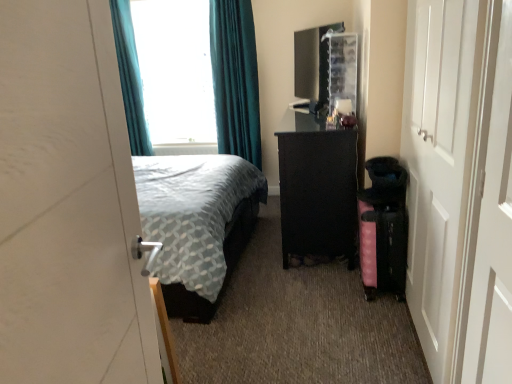
Locate an element on the screen. Image resolution: width=512 pixels, height=384 pixels. teal fabric curtain at upper center, the 2th curtain in the left-to-right sequence is located at coordinates (234, 79).

What do you see at coordinates (325, 67) in the screenshot?
I see `black glossy file cabinet at upper center` at bounding box center [325, 67].

In order to face black glossy file cabinet at upper center, should I rotate leftwards or rightwards?

Rotate your view right by about 7.676°.

Measure the distance between teal fabric curtain at upper left, the 2th curtain from the right, and camera.

teal fabric curtain at upper left, the 2th curtain from the right, and camera are 3.67 meters apart.

The height and width of the screenshot is (384, 512). What do you see at coordinates (175, 71) in the screenshot?
I see `teal fabric curtain at upper left` at bounding box center [175, 71].

In order to face black textured dresser at center, should I rotate leftwards or rightwards?

Rotate your view right by about 8.618°.

Find the location of a particular element. teal fabric curtain at upper center, the 1th curtain in the right-to-left sequence is located at coordinates (234, 79).

From a real-world perspective, does teal fabric curtain at upper left, the 2th curtain from the right, stand above teal fabric curtain at upper left?

No, from a real-world perspective, teal fabric curtain at upper left, the 2th curtain from the right, is not above teal fabric curtain at upper left.

Considering the relative positions of teal fabric curtain at upper left, positioned as the 1th curtain in left-to-right order, and teal fabric curtain at upper left in the image provided, is teal fabric curtain at upper left, positioned as the 1th curtain in left-to-right order, to the left of teal fabric curtain at upper left from the viewer's perspective?

Yes, teal fabric curtain at upper left, positioned as the 1th curtain in left-to-right order, is to the left of teal fabric curtain at upper left.

In terms of width, does teal fabric curtain at upper left, the 2th curtain from the right, look wider or thinner when compared to teal fabric curtain at upper left?

teal fabric curtain at upper left, the 2th curtain from the right, is thinner than teal fabric curtain at upper left.

Is teal fabric curtain at upper left, the 2th curtain from the right, far from teal fabric curtain at upper left?

teal fabric curtain at upper left, the 2th curtain from the right, is actually quite close to teal fabric curtain at upper left.

Considering the relative positions of black textured dresser at center and teal fabric curtain at upper center, the 2th curtain in the left-to-right sequence, in the image provided, is black textured dresser at center behind teal fabric curtain at upper center, the 2th curtain in the left-to-right sequence,?

No.

From the picture: Which object is wider, black textured dresser at center or teal fabric curtain at upper center, the 2th curtain in the left-to-right sequence?

Wider between the two is black textured dresser at center.

Is black textured dresser at center facing towards teal fabric curtain at upper center, the 2th curtain in the left-to-right sequence?

No, black textured dresser at center is not aimed at teal fabric curtain at upper center, the 2th curtain in the left-to-right sequence.

Considering the relative sizes of black textured dresser at center and teal fabric curtain at upper center, the 2th curtain in the left-to-right sequence, in the image provided, is black textured dresser at center shorter than teal fabric curtain at upper center, the 2th curtain in the left-to-right sequence,?

Indeed, black textured dresser at center has a lesser height compared to teal fabric curtain at upper center, the 2th curtain in the left-to-right sequence.

Which of these two, pink fabric suitcase at lower right or white wooden door at right, acting as the 2th door starting from the left, is thinner?

With smaller width is white wooden door at right, acting as the 2th door starting from the left.

Is pink fabric suitcase at lower right positioned far away from white wooden door at right, acting as the 2th door starting from the left?

pink fabric suitcase at lower right is near white wooden door at right, acting as the 2th door starting from the left, not far away.

Based on the photo, how many degrees apart are the facing directions of pink fabric suitcase at lower right and white wooden door at right, the first door viewed from the back?

2.03 degrees separate the facing orientations of pink fabric suitcase at lower right and white wooden door at right, the first door viewed from the back.

How far apart are pink fabric suitcase at lower right and white wooden door at right, the first door viewed from the back?

The distance of pink fabric suitcase at lower right from white wooden door at right, the first door viewed from the back, is 27.84 inches.

Consider the image. Considering the relative sizes of teal fabric curtain at upper center, the 1th curtain in the right-to-left sequence, and white wooden door at right, acting as the 2th door starting from the left, in the image provided, is teal fabric curtain at upper center, the 1th curtain in the right-to-left sequence, smaller than white wooden door at right, acting as the 2th door starting from the left,?

No, teal fabric curtain at upper center, the 1th curtain in the right-to-left sequence, is not smaller than white wooden door at right, acting as the 2th door starting from the left.

Can you confirm if teal fabric curtain at upper center, the 2th curtain in the left-to-right sequence, is positioned to the left of white wooden door at right, the first door viewed from the back?

Yes.

Considering the sizes of objects teal fabric curtain at upper center, the 1th curtain in the right-to-left sequence, and white wooden door at right, the first door from the right, in the image provided, who is wider, teal fabric curtain at upper center, the 1th curtain in the right-to-left sequence, or white wooden door at right, the first door from the right,?

teal fabric curtain at upper center, the 1th curtain in the right-to-left sequence.

From the image's perspective, is teal fabric curtain at upper center, the 1th curtain in the right-to-left sequence, on top of white wooden door at right, the first door from the right?

Correct, teal fabric curtain at upper center, the 1th curtain in the right-to-left sequence, appears higher than white wooden door at right, the first door from the right, in the image.

Is teal fabric curtain at upper left in contact with black glossy file cabinet at upper center?

No, teal fabric curtain at upper left is not in contact with black glossy file cabinet at upper center.

Is teal fabric curtain at upper left inside the boundaries of black glossy file cabinet at upper center, or outside?

teal fabric curtain at upper left is not inside black glossy file cabinet at upper center, it's outside.

This screenshot has height=384, width=512. Identify the location of window that is above the black glossy file cabinet at upper center (from the image's perspective). (175, 71).

Can you confirm if teal fabric curtain at upper left is taller than black glossy file cabinet at upper center?

Yes, teal fabric curtain at upper left is taller than black glossy file cabinet at upper center.

Is teal fabric curtain at upper left closer to the viewer compared to teal fabric curtain at upper center, the 1th curtain in the right-to-left sequence?

That is False.

Is teal fabric curtain at upper left in contact with teal fabric curtain at upper center, the 1th curtain in the right-to-left sequence?

No, teal fabric curtain at upper left is not next to teal fabric curtain at upper center, the 1th curtain in the right-to-left sequence.

From a real-world perspective, who is located lower, teal fabric curtain at upper left or teal fabric curtain at upper center, the 1th curtain in the right-to-left sequence?

In real-world perspective, teal fabric curtain at upper center, the 1th curtain in the right-to-left sequence, is lower.

Is point (179, 94) more distant than point (236, 5)?

Yes.

Does black glossy file cabinet at upper center have a greater height compared to teal fabric curtain at upper left, the 2th curtain from the right?

Incorrect, the height of black glossy file cabinet at upper center is not larger of that of teal fabric curtain at upper left, the 2th curtain from the right.

Considering the relative positions of black glossy file cabinet at upper center and teal fabric curtain at upper left, positioned as the 1th curtain in left-to-right order, in the image provided, is black glossy file cabinet at upper center behind teal fabric curtain at upper left, positioned as the 1th curtain in left-to-right order,?

No, black glossy file cabinet at upper center is in front of teal fabric curtain at upper left, positioned as the 1th curtain in left-to-right order.

Which object is positioned more to the left, black glossy file cabinet at upper center or teal fabric curtain at upper left, positioned as the 1th curtain in left-to-right order?

teal fabric curtain at upper left, positioned as the 1th curtain in left-to-right order, is more to the left.

Between black glossy file cabinet at upper center and teal fabric curtain at upper left, positioned as the 1th curtain in left-to-right order, which one has larger size?

black glossy file cabinet at upper center is bigger.

In order to click on window behind the teal fabric curtain at upper left, the 2th curtain from the right in this screenshot , I will do `click(175, 71)`.

Image resolution: width=512 pixels, height=384 pixels. What are the coordinates of `the 1st curtain above the black textured dresser at center (from the image's perspective)` in the screenshot? It's located at (234, 79).

From the image, which object appears to be nearer to pink fabric suitcase at lower right, teal fabric curtain at upper center, the 2th curtain in the left-to-right sequence, or teal fabric curtain at upper left?

teal fabric curtain at upper center, the 2th curtain in the left-to-right sequence.

Considering their positions, is pink fabric suitcase at lower right positioned closer to black glossy file cabinet at upper center than teal fabric curtain at upper center, the 1th curtain in the right-to-left sequence?

The object closer to black glossy file cabinet at upper center is pink fabric suitcase at lower right.

Estimate the real-world distances between objects in this image. Which object is closer to teal fabric curtain at upper left, positioned as the 1th curtain in left-to-right order, black textured dresser at center or white wooden door at right, the first door viewed from the back?

The object closer to teal fabric curtain at upper left, positioned as the 1th curtain in left-to-right order, is black textured dresser at center.

When comparing their distances from white matte door at left, which appears as the 2th door when viewed from the right, does black textured dresser at center or teal fabric curtain at upper center, the 2th curtain in the left-to-right sequence, seem closer?

black textured dresser at center is positioned closer to the anchor white matte door at left, which appears as the 2th door when viewed from the right.

Looking at the image, which one is located closer to teal fabric curtain at upper left, the 2th curtain from the right, pink fabric suitcase at lower right or black textured dresser at center?

Based on the image, black textured dresser at center appears to be nearer to teal fabric curtain at upper left, the 2th curtain from the right.

When comparing their distances from teal fabric curtain at upper center, the 2th curtain in the left-to-right sequence, does pink fabric suitcase at lower right or white matte door at left, which appears as the 2th door when viewed from the right, seem further?

white matte door at left, which appears as the 2th door when viewed from the right.

Which object lies nearer to the anchor point teal fabric curtain at upper left, teal fabric curtain at upper center, the 1th curtain in the right-to-left sequence, or pink fabric suitcase at lower right?

Based on the image, teal fabric curtain at upper center, the 1th curtain in the right-to-left sequence, appears to be nearer to teal fabric curtain at upper left.

Considering their positions, is teal fabric curtain at upper left, positioned as the 1th curtain in left-to-right order, positioned further to pink fabric suitcase at lower right than black glossy file cabinet at upper center?

teal fabric curtain at upper left, positioned as the 1th curtain in left-to-right order.

Locate an element on the screen. curtain between white matte door at left, marked as the second door in a back-to-front arrangement, and teal fabric curtain at upper left, positioned as the 1th curtain in left-to-right order, along the z-axis is located at coordinates (234, 79).

At what (x,y) coordinates should I click in order to perform the action: click on luggage located between white wooden door at right, the first door viewed from the back, and teal fabric curtain at upper left in the depth direction. Please return your answer as a coordinate pair (x, y). The height and width of the screenshot is (384, 512). Looking at the image, I should click on (383, 244).

Find the location of `file cabinet located between white matte door at left, which appears as the 2th door when viewed from the right, and teal fabric curtain at upper center, the 2th curtain in the left-to-right sequence, in the depth direction`. file cabinet located between white matte door at left, which appears as the 2th door when viewed from the right, and teal fabric curtain at upper center, the 2th curtain in the left-to-right sequence, in the depth direction is located at coordinates (325, 67).

Locate an element on the screen. The height and width of the screenshot is (384, 512). door between white matte door at left, marked as the second door in a back-to-front arrangement, and teal fabric curtain at upper left, the 2th curtain from the right, from front to back is located at coordinates (460, 186).